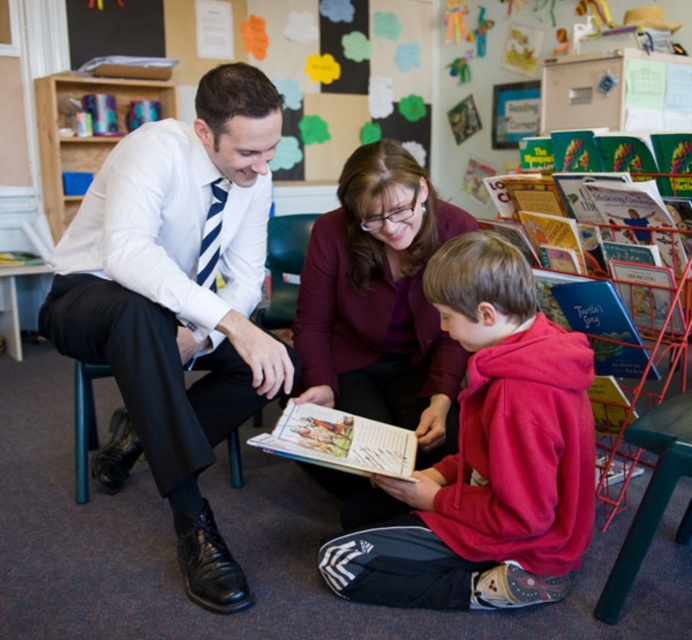
Question: Among these points, which one is nearest to the camera?

Choices:
 (A) (336, 465)
 (B) (493, 236)
 (C) (370, 320)

Answer: (B)

Question: Based on their relative distances, which object is farther from the hardcover book at center?

Choices:
 (A) red fleece hoodie at center
 (B) colorful paper flowers at upper center

Answer: (B)

Question: Is matte purple blazer at center to the right of hardcover book at center from the viewer's perspective?

Choices:
 (A) yes
 (B) no

Answer: (A)

Question: Which object appears farthest from the camera in this image?

Choices:
 (A) red fleece hoodie at center
 (B) matte purple blazer at center
 (C) white shirt at left
 (D) colorful paper flowers at upper center

Answer: (D)

Question: From the image, what is the correct spatial relationship of red fleece hoodie at center in relation to black fabric chair at left?

Choices:
 (A) above
 (B) below

Answer: (A)

Question: Can you confirm if matte purple blazer at center is positioned below hardcover book at center?

Choices:
 (A) no
 (B) yes

Answer: (A)